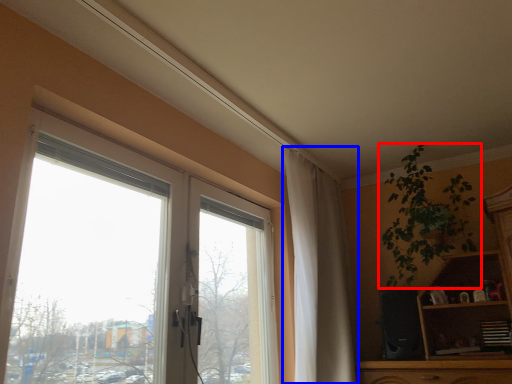
Question: Among these objects, which one is nearest to the camera, houseplant (highlighted by a red box) or curtain (highlighted by a blue box)?

Choices:
 (A) houseplant
 (B) curtain

Answer: (B)